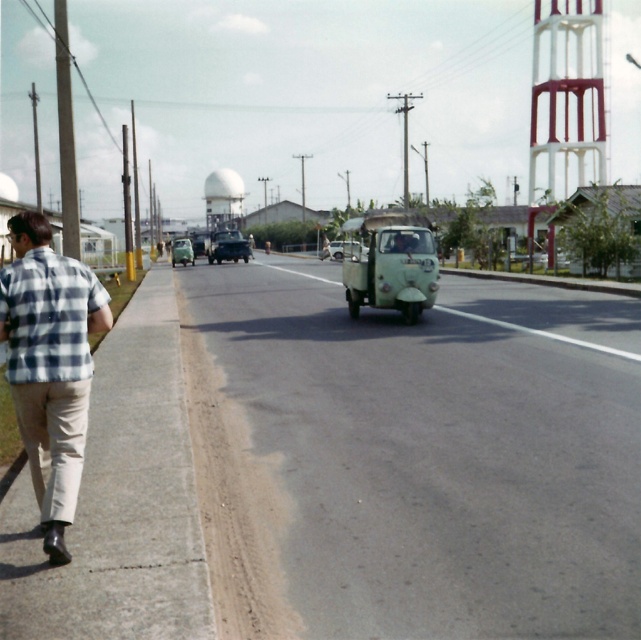
You are standing at the point labeled point (362, 275) and want to walk towards the point labeled point (24, 333). Which direction should you face to move towards it?

You should face towards the camera because point (24, 333) is closer to the camera than point (362, 275).

You are a photographer standing at the camera position. You want to capture the plaid cotton shirt at left in your photo. The camera has a rectangular viewfinder. The viewfinder has a coordinate system where the bottom left corner is the origin point. The coordinates of the plaid cotton shirt at left are given as point (49,364). What is the position of the plaid cotton shirt at left in the viewfinder?

The plaid cotton shirt at left is located at coordinates 0.570 on the x axis and 0.078 on the y axis in the viewfinder.

You are a photographer trying to capture both the plaid cotton shirt at left and the green matte car at center in a single frame. Which object should you zoom in on to ensure both are visible without cropping?

The plaid cotton shirt at left is narrower than the green matte car at center, so you should zoom in on the green matte car at center to ensure both fit in the frame.